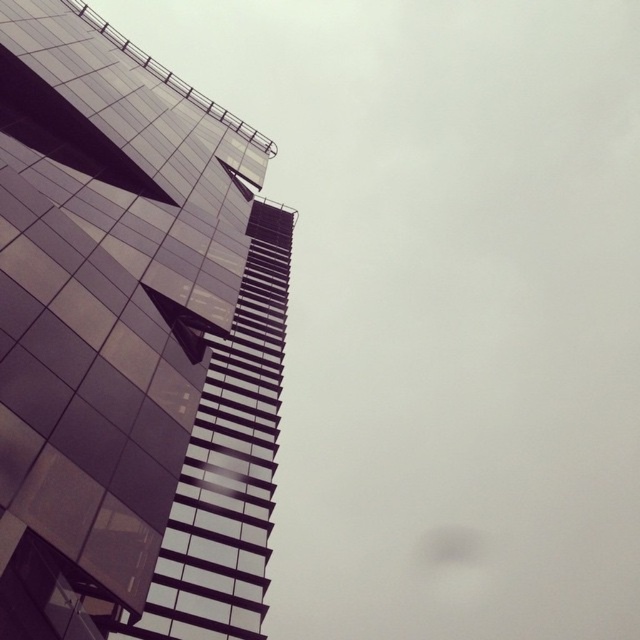
Is reflective glass building at left above reflective glass tower at upper left?

Correct, reflective glass building at left is located above reflective glass tower at upper left.

Between point (211, 522) and point (220, 429), which one is positioned in front?

Positioned in front is point (211, 522).

Locate an element on the screen. reflective glass building at left is located at coordinates (131, 340).